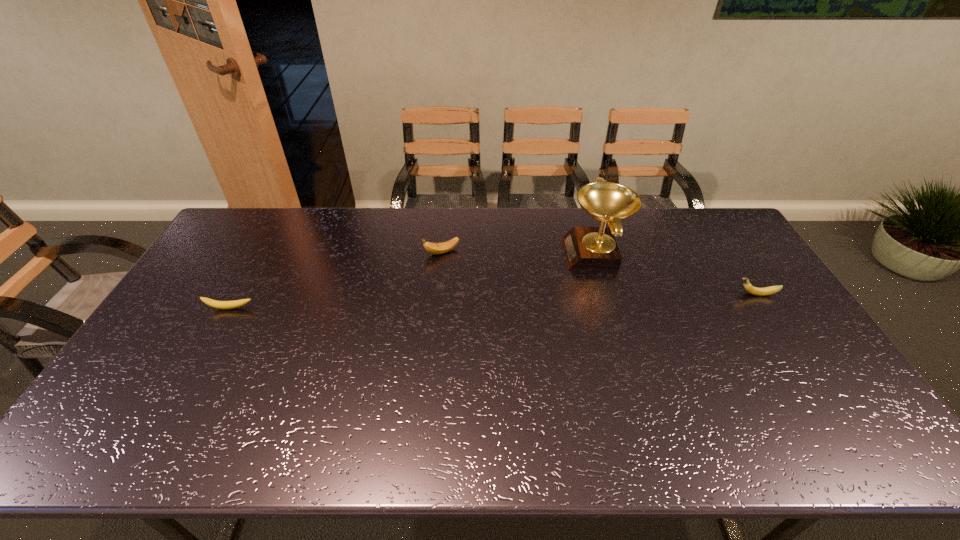
At what (x,y) coordinates should I click in order to perform the action: click on free point between the second object from right to left and the nearest object. Please return your answer as a coordinate pair (x, y). Looking at the image, I should click on (413, 281).

Where is `vacant region between the second banana from right to left and the shortest banana`? vacant region between the second banana from right to left and the shortest banana is located at coordinates (336, 280).

Where is `empty space between the rightmost object and the second banana from right to left`? empty space between the rightmost object and the second banana from right to left is located at coordinates (599, 273).

Image resolution: width=960 pixels, height=540 pixels. I want to click on free space between the second object from left to right and the rightmost object, so click(x=599, y=273).

Identify which object is the second nearest to the third object from right to left. Please provide its 2D coordinates. Your answer should be formatted as a tuple, i.e. [(x, y)], where the tuple contains the x and y coordinates of a point satisfying the conditions above.

[(224, 305)]

The height and width of the screenshot is (540, 960). Find the location of `object identified as the second closest to the third object from left to right`. object identified as the second closest to the third object from left to right is located at coordinates (434, 248).

Identify which banana is located as the second nearest to the third farthest object. Please provide its 2D coordinates. Your answer should be formatted as a tuple, i.e. [(x, y)], where the tuple contains the x and y coordinates of a point satisfying the conditions above.

[(224, 305)]

Select which banana appears as the closest to the tallest object. Please provide its 2D coordinates. Your answer should be formatted as a tuple, i.e. [(x, y)], where the tuple contains the x and y coordinates of a point satisfying the conditions above.

[(749, 288)]

Where is `vacant space that satisfies the following two spatial constraints: 1. on the front-facing side of the second object from right to left; 2. on the upward curve of the leftmost banana`? Image resolution: width=960 pixels, height=540 pixels. vacant space that satisfies the following two spatial constraints: 1. on the front-facing side of the second object from right to left; 2. on the upward curve of the leftmost banana is located at coordinates (612, 308).

The height and width of the screenshot is (540, 960). What are the coordinates of `free location that satisfies the following two spatial constraints: 1. at the stem of the second nearest banana; 2. on the upward curve of the shortest banana` in the screenshot? It's located at (765, 308).